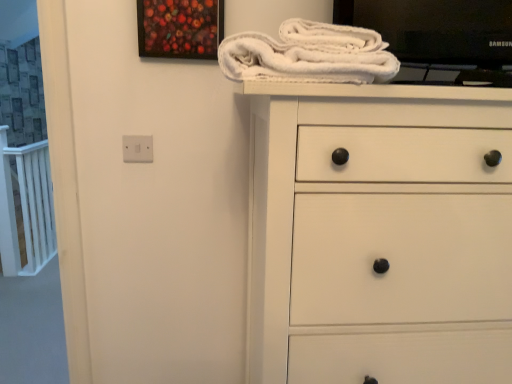
From the picture: Measure the distance between point (215, 38) and camera.

The depth of point (215, 38) is 1.21 meters.

Describe the element at coordinates (308, 55) in the screenshot. The image size is (512, 384). I see `white fluffy bath towel at upper center` at that location.

This screenshot has height=384, width=512. I want to click on painted wood picture frame at upper center, so click(x=180, y=28).

From the image's perspective, is painted wood picture frame at upper center under white fluffy bath towel at upper center?

No, from the image's perspective, painted wood picture frame at upper center is not beneath white fluffy bath towel at upper center.

Which point is more forward, (198, 8) or (377, 61)?

The point (377, 61) is closer.

What's the angular difference between painted wood picture frame at upper center and white fluffy bath towel at upper center's facing directions?

They differ by 12.9 degrees in their facing directions.

Identify the location of bath towel located on the right of painted wood picture frame at upper center. This screenshot has width=512, height=384. (308, 55).

Is white fluffy bath towel at upper center far away from painted wood picture frame at upper center?

white fluffy bath towel at upper center is actually quite close to painted wood picture frame at upper center.

Between white fluffy bath towel at upper center and painted wood picture frame at upper center, which one appears on the left side from the viewer's perspective?

painted wood picture frame at upper center.

Is point (297, 75) more distant than point (181, 11)?

No, (297, 75) is in front of (181, 11).

Is white fluffy bath towel at upper center inside or outside of white matte chest of drawers at center?

white fluffy bath towel at upper center lies outside white matte chest of drawers at center.

This screenshot has height=384, width=512. Identify the location of bath towel located behind the white matte chest of drawers at center. (308, 55).

How much distance is there between white fluffy bath towel at upper center and white matte chest of drawers at center?

They are 9.61 inches apart.

Between white fluffy bath towel at upper center and white matte chest of drawers at center, which one has less height?

With less height is white fluffy bath towel at upper center.

From a real-world perspective, is white matte chest of drawers at center positioned over white fluffy bath towel at upper center based on gravity?

No, from a real-world perspective, white matte chest of drawers at center is not on top of white fluffy bath towel at upper center.

Does white matte chest of drawers at center turn towards white fluffy bath towel at upper center?

No.

Is white matte chest of drawers at center next to painted wood picture frame at upper center and touching it?

No, white matte chest of drawers at center is not with painted wood picture frame at upper center.

From the picture: Which is more to the right, white matte chest of drawers at center or painted wood picture frame at upper center?

white matte chest of drawers at center.

Considering the points (329, 356) and (193, 44), which point is in front, point (329, 356) or point (193, 44)?

The point (329, 356) is more forward.

From a real-world perspective, which object stands above the other?

painted wood picture frame at upper center is physically above.

Can you confirm if painted wood picture frame at upper center is shorter than white matte chest of drawers at center?

Correct, painted wood picture frame at upper center is not as tall as white matte chest of drawers at center.

Considering the points (149, 1) and (324, 245), which point is behind, point (149, 1) or point (324, 245)?

The point (149, 1) is behind.

Is painted wood picture frame at upper center outside of white matte chest of drawers at center?

Yes, painted wood picture frame at upper center is not within white matte chest of drawers at center.

Relative to white matte chest of drawers at center, is painted wood picture frame at upper center in front or behind?

painted wood picture frame at upper center is positioned farther from the viewer than white matte chest of drawers at center.

At what (x,y) coordinates should I click in order to perform the action: click on picture frame above the white fluffy bath towel at upper center (from the image's perspective). Please return your answer as a coordinate pair (x, y). This screenshot has width=512, height=384. Looking at the image, I should click on (180, 28).

This screenshot has height=384, width=512. Find the location of `bath towel below the painted wood picture frame at upper center (from a real-world perspective)`. bath towel below the painted wood picture frame at upper center (from a real-world perspective) is located at coordinates (308, 55).

From the picture: From the image, which object appears to be nearer to white matte chest of drawers at center, painted wood picture frame at upper center or white fluffy bath towel at upper center?

white fluffy bath towel at upper center is closer to white matte chest of drawers at center.

When comparing their distances from white matte chest of drawers at center, does white fluffy bath towel at upper center or painted wood picture frame at upper center seem closer?

white fluffy bath towel at upper center is positioned closer to the anchor white matte chest of drawers at center.

Estimate the real-world distances between objects in this image. Which object is closer to painted wood picture frame at upper center, white matte chest of drawers at center or white fluffy bath towel at upper center?

white fluffy bath towel at upper center lies closer to painted wood picture frame at upper center than the other object.

Based on their spatial positions, is white fluffy bath towel at upper center or white matte chest of drawers at center closer to painted wood picture frame at upper center?

Based on the image, white fluffy bath towel at upper center appears to be nearer to painted wood picture frame at upper center.

Based on their spatial positions, is painted wood picture frame at upper center or white matte chest of drawers at center further from white fluffy bath towel at upper center?

Based on the image, painted wood picture frame at upper center appears to be further to white fluffy bath towel at upper center.

Based on their spatial positions, is white matte chest of drawers at center or painted wood picture frame at upper center further from white fluffy bath towel at upper center?

painted wood picture frame at upper center lies further to white fluffy bath towel at upper center than the other object.

Locate an element on the screen. The image size is (512, 384). bath towel between painted wood picture frame at upper center and white matte chest of drawers at center in the up-down direction is located at coordinates (308, 55).